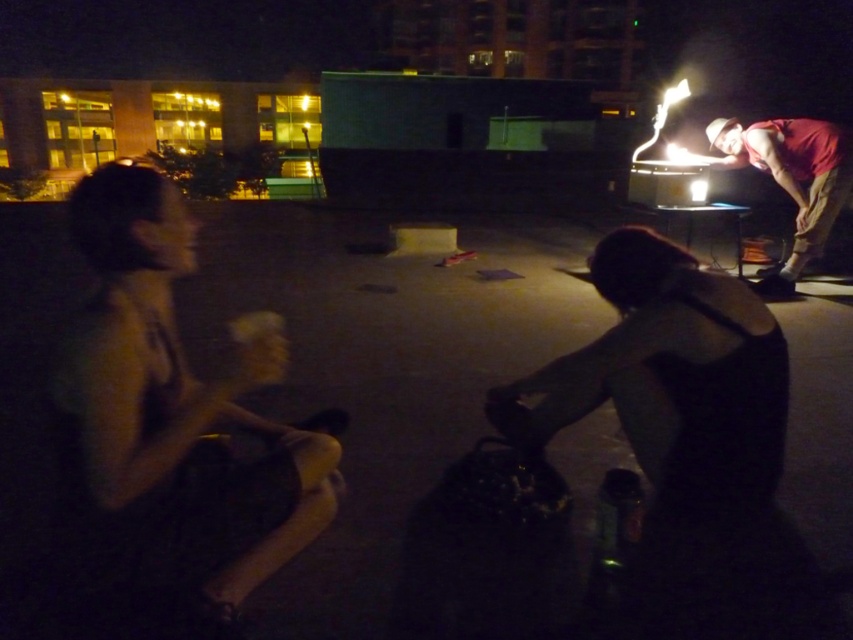
Who is taller, black matte tank top at lower right or red fabric shirt at right?

red fabric shirt at right is taller.

Does point (643, 276) come farther from viewer compared to point (831, 154)?

No.

What are the coordinates of `black matte tank top at lower right` in the screenshot? It's located at (677, 420).

Who is taller, dark skin tone shirt at left or black matte tank top at lower right?

With more height is black matte tank top at lower right.

Looking at this image, between dark skin tone shirt at left and black matte tank top at lower right, which one is positioned lower?

dark skin tone shirt at left

Describe the element at coordinates (167, 435) in the screenshot. I see `dark skin tone shirt at left` at that location.

Find the location of a particular element. dark skin tone shirt at left is located at coordinates (167, 435).

Between dark skin tone shirt at left and red fabric shirt at right, which one appears on the right side from the viewer's perspective?

red fabric shirt at right is more to the right.

Does dark skin tone shirt at left appear on the left side of red fabric shirt at right?

Indeed, dark skin tone shirt at left is positioned on the left side of red fabric shirt at right.

Where is `dark skin tone shirt at left`? This screenshot has width=853, height=640. dark skin tone shirt at left is located at coordinates (167, 435).